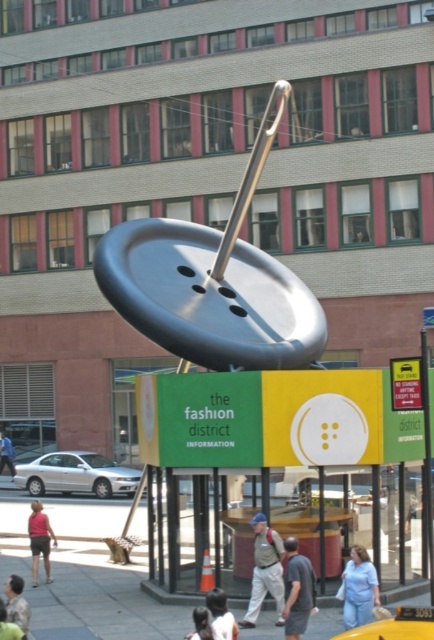
Question: Is gray fabric shirt at lower center closer to camera compared to matte pink shirt at lower left?

Choices:
 (A) yes
 (B) no

Answer: (A)

Question: Which object is positioned farthest from the matte pink shirt at lower left?

Choices:
 (A) light brown hair at lower left
 (B) light blue shirt at lower center
 (C) brushed metal pole at right

Answer: (B)

Question: Which object is positioned farthest from the gray fabric shirt at lower center?

Choices:
 (A) blonde hair at lower center
 (B) denim pants at lower right

Answer: (A)

Question: Is concrete sidewalk at lower center below denim pants at lower right?

Choices:
 (A) yes
 (B) no

Answer: (A)

Question: From the image, what is the correct spatial relationship of concrete sidewalk at lower center in relation to matte pink shirt at lower left?

Choices:
 (A) above
 (B) below

Answer: (B)

Question: Which object is farther from the camera taking this photo?

Choices:
 (A) blonde hair at lower center
 (B) denim pants at lower right
 (C) matte pink shirt at lower left
 (D) concrete sidewalk at lower center

Answer: (C)